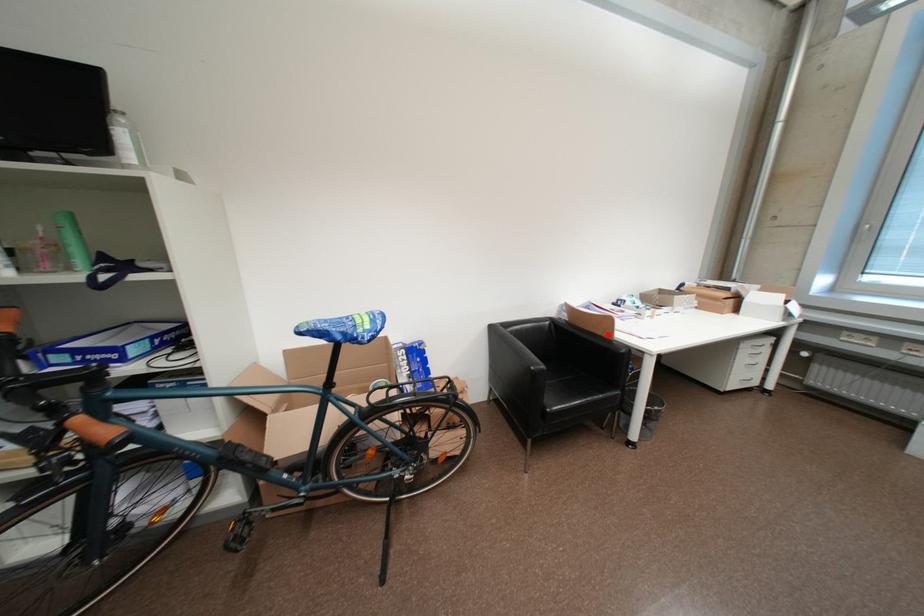
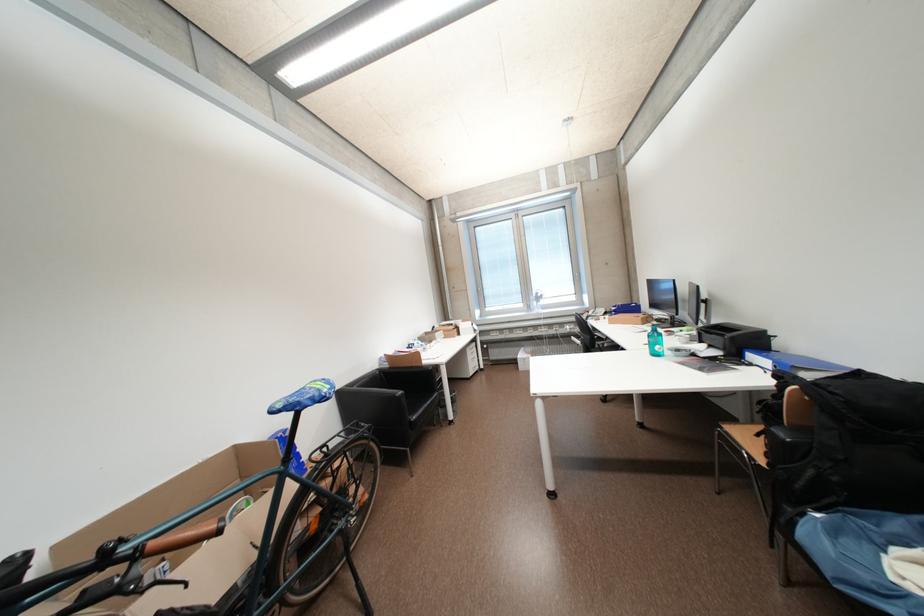
Find the pixel in the second image that matches the highlighted location in the first image.

(421, 367)